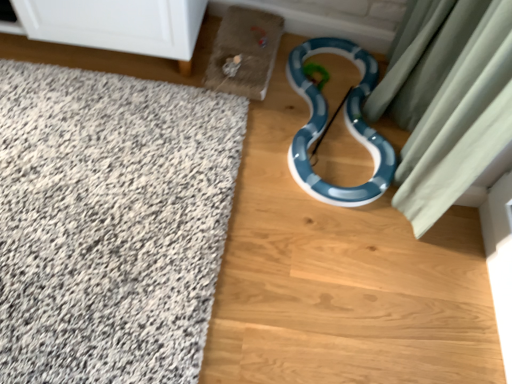
Where is `free space underneath blue glossy snake at center (from a real-world perspective)`? free space underneath blue glossy snake at center (from a real-world perspective) is located at coordinates (348, 132).